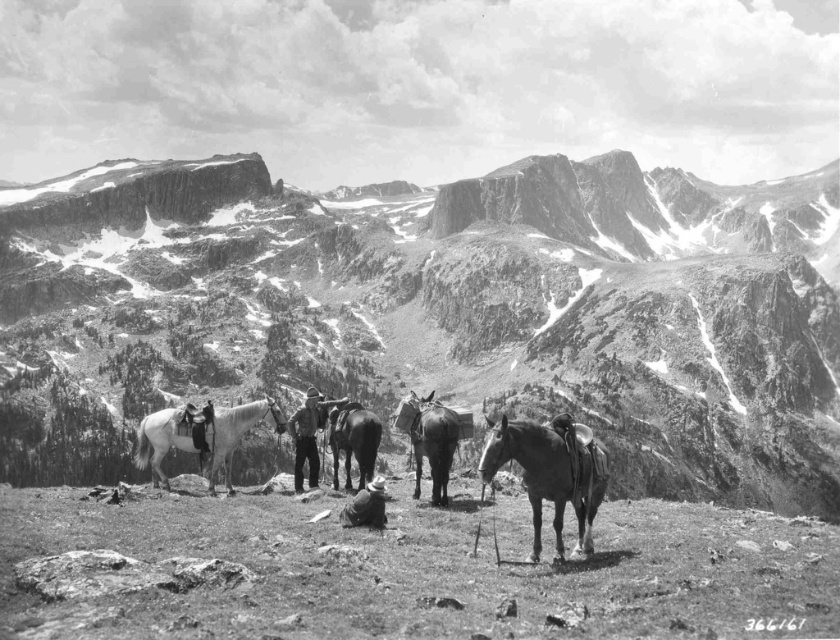
You are a traveler planning to ride the shiny dark brown horse at center. Where is the white leather saddle at center positioned relative to the horse?

The white leather saddle at center is located below the shiny dark brown horse at center.

You are a photographer standing in the mountainous landscape. You want to take a photo of both the shiny dark brown horse at center and the shiny black donkey at center. Which one should you focus on first to ensure it appears sharp in the photo?

You should focus on the shiny dark brown horse at center first because it is closer to the viewer than the shiny black donkey at center, so focusing on the closer object ensures it will be sharp.